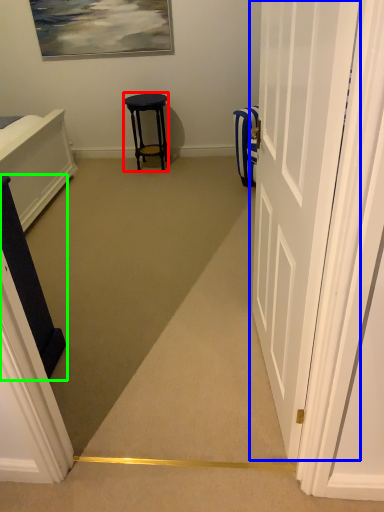
Question: Considering the real-world distances, which object is closest to stool (highlighted by a red box)? door (highlighted by a blue box) or furniture (highlighted by a green box).

Choices:
 (A) door
 (B) furniture

Answer: (B)